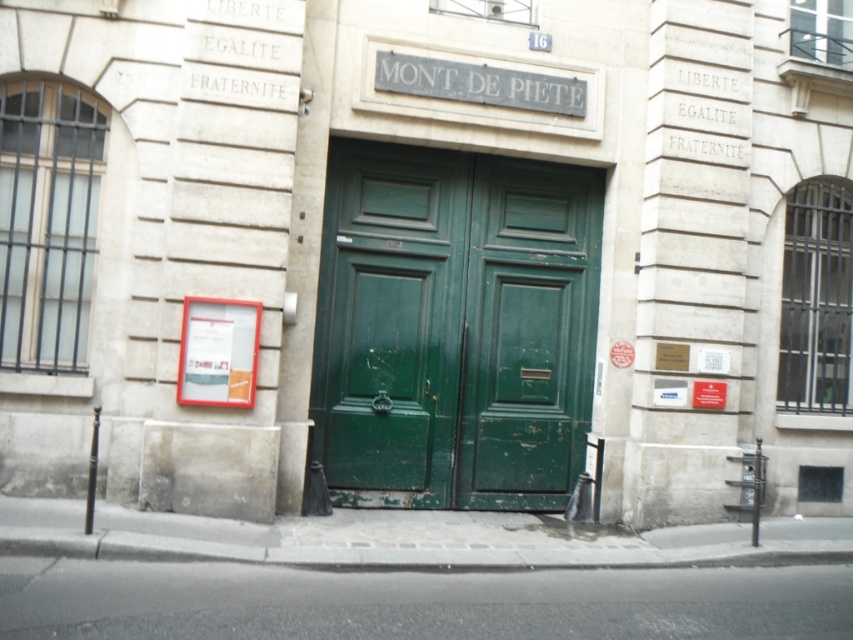
Question: Does green matte door at center appear over green wood door at center?

Choices:
 (A) no
 (B) yes

Answer: (B)

Question: Which point is closer to the camera?

Choices:
 (A) (364, 198)
 (B) (525, 256)

Answer: (A)

Question: Can you confirm if green matte door at center is positioned to the left of green wood door at center?

Choices:
 (A) no
 (B) yes

Answer: (B)

Question: Which object appears farthest from the camera in this image?

Choices:
 (A) green wood door at center
 (B) green matte door at center

Answer: (A)

Question: Can you confirm if green matte door at center is positioned to the left of green wood door at center?

Choices:
 (A) yes
 (B) no

Answer: (A)

Question: Which point is farther to the camera?

Choices:
 (A) green wood door at center
 (B) green matte door at center

Answer: (A)